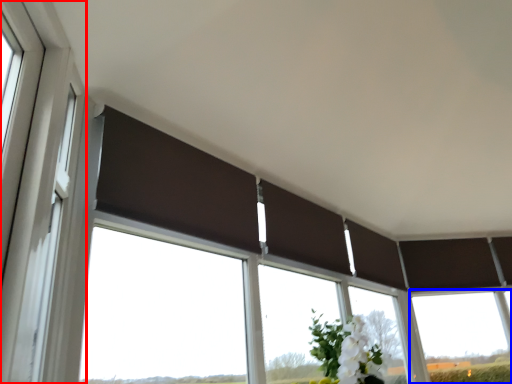
Question: Which of the following is the farthest to the observer, window frame (highlighted by a red box) or window (highlighted by a blue box)?

Choices:
 (A) window frame
 (B) window

Answer: (B)